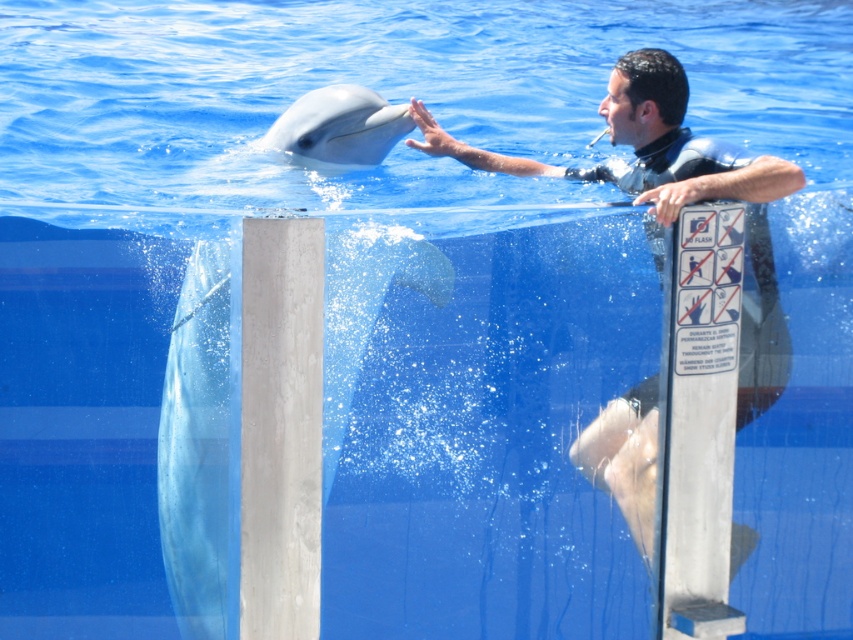
The width and height of the screenshot is (853, 640). Describe the element at coordinates (674, 195) in the screenshot. I see `smooth black wetsuit at upper center` at that location.

How much distance is there between smooth black wetsuit at upper center and white smooth dolphin at center?

smooth black wetsuit at upper center is 1.74 meters from white smooth dolphin at center.

Between point (648, 148) and point (376, 113), which one is positioned in front?

Point (648, 148)

You are a GUI agent. You are given a task and a screenshot of the screen. Output one action in this format:
    pyautogui.click(x=<x>, y=<y>)
    Task: Click on the smooth black wetsuit at upper center
    The height and width of the screenshot is (640, 853).
    Given the screenshot: What is the action you would take?
    pyautogui.click(x=674, y=195)